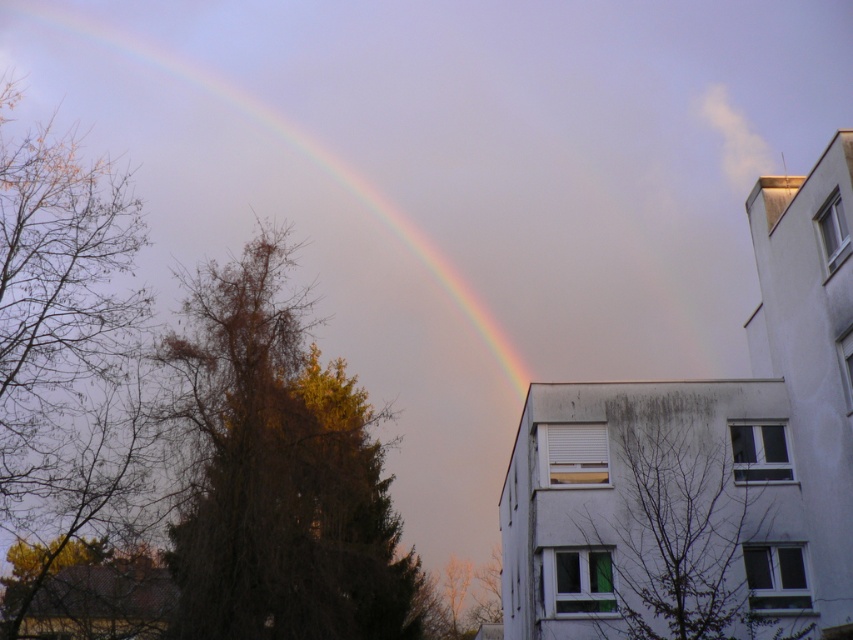
Where is `brown leafy tree at left`? This screenshot has height=640, width=853. brown leafy tree at left is located at coordinates (65, 333).

Is brown leafy tree at left below brown leafless tree at center-right?

Actually, brown leafy tree at left is above brown leafless tree at center-right.

Is point (18, 388) farther from viewer compared to point (735, 621)?

Yes, it is.

Identify the location of brown leafy tree at left. The height and width of the screenshot is (640, 853). (65, 333).

Which is behind, point (279, 243) or point (102, 400)?

The point (279, 243) is behind.

Between point (227, 422) and point (128, 216), which one is positioned in front?

Point (227, 422) is in front.

Does point (280, 536) lie in front of point (84, 401)?

Yes, it is.

Find the location of a particular element. brown/drytree at center is located at coordinates (277, 472).

Can you confirm if brown/drytree at center is shorter than brown leafless tree at center-right?

In fact, brown/drytree at center may be taller than brown leafless tree at center-right.

Can you confirm if brown/drytree at center is positioned above brown leafless tree at center-right?

No.

Where is `brown/drytree at center`? The height and width of the screenshot is (640, 853). brown/drytree at center is located at coordinates (277, 472).

In order to click on brown/drytree at center in this screenshot , I will do `click(277, 472)`.